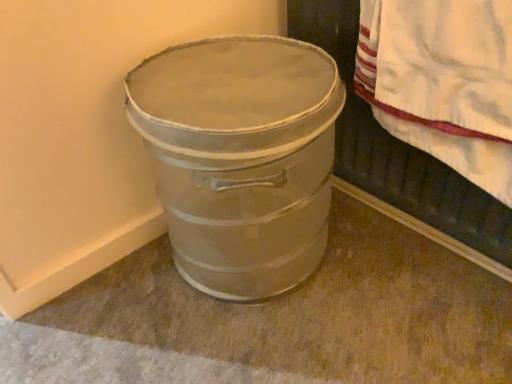
What do you see at coordinates (241, 158) in the screenshot? I see `metallic gray bucket at lower left` at bounding box center [241, 158].

You are a GUI agent. You are given a task and a screenshot of the screen. Output one action in this format:
    pyautogui.click(x=<x>, y=<y>)
    Task: Click on the metallic silver bucket at lower left
    
    Given the screenshot: What is the action you would take?
    pyautogui.click(x=280, y=319)

The image size is (512, 384). Find the location of `metallic gray bucket at lower left`. metallic gray bucket at lower left is located at coordinates (241, 158).

Is white textured towel at upper right positioned with its back to metallic silver bucket at lower left?

No, white textured towel at upper right is not facing the opposite direction of metallic silver bucket at lower left.

Is the surface of white textured towel at upper right in direct contact with metallic silver bucket at lower left?

white textured towel at upper right and metallic silver bucket at lower left are not in contact.

From the image's perspective, would you say white textured towel at upper right is positioned over metallic silver bucket at lower left?

Yes, from the image's perspective, white textured towel at upper right is over metallic silver bucket at lower left.

Do you think white textured towel at upper right is within metallic silver bucket at lower left, or outside of it?

white textured towel at upper right is not inside metallic silver bucket at lower left, it's outside.

Is metallic gray bucket at lower left completely or partially outside of white textured towel at upper right?

That's correct, metallic gray bucket at lower left is outside of white textured towel at upper right.

From the image's perspective, is metallic gray bucket at lower left under white textured towel at upper right?

Yes, from the image's perspective, metallic gray bucket at lower left is beneath white textured towel at upper right.

Which object is positioned more to the right, metallic gray bucket at lower left or white textured towel at upper right?

From the viewer's perspective, white textured towel at upper right appears more on the right side.

Is metallic gray bucket at lower left with white textured towel at upper right?

No, metallic gray bucket at lower left is not beside white textured towel at upper right.

Is metallic silver bucket at lower left inside or outside of white textured towel at upper right?

The correct answer is: outside.

Is metallic silver bucket at lower left not close to white textured towel at upper right?

metallic silver bucket at lower left is actually quite close to white textured towel at upper right.

Consider the image. Which of these two, metallic silver bucket at lower left or white textured towel at upper right, is thinner?

white textured towel at upper right.

Between metallic silver bucket at lower left and white textured towel at upper right, which one has more height?

white textured towel at upper right is taller.

You are a GUI agent. You are given a task and a screenshot of the screen. Output one action in this format:
    pyautogui.click(x=<x>, y=<y>)
    Task: Click on the waste container lying behind the metallic silver bucket at lower left
    The image size is (512, 384).
    Given the screenshot: What is the action you would take?
    (x=241, y=158)

How different are the orientations of metallic gray bucket at lower left and metallic silver bucket at lower left in degrees?

There is a 90.6-degree angle between the facing directions of metallic gray bucket at lower left and metallic silver bucket at lower left.

Is metallic gray bucket at lower left to the right of metallic silver bucket at lower left from the viewer's perspective?

In fact, metallic gray bucket at lower left is to the left of metallic silver bucket at lower left.

Is metallic gray bucket at lower left positioned with its back to metallic silver bucket at lower left?

No, metallic silver bucket at lower left is not at the back of metallic gray bucket at lower left.

From a real-world perspective, relative to metallic gray bucket at lower left, is metallic silver bucket at lower left vertically above or below?

In terms of real-world spatial position, metallic silver bucket at lower left is below metallic gray bucket at lower left.

Which object is positioned more to the left, metallic silver bucket at lower left or metallic gray bucket at lower left?

metallic gray bucket at lower left is more to the left.

Based on the photo, is metallic silver bucket at lower left looking in the opposite direction of metallic gray bucket at lower left?

Yes, metallic silver bucket at lower left is facing away from metallic gray bucket at lower left.

Considering the relative sizes of metallic silver bucket at lower left and metallic gray bucket at lower left in the image provided, is metallic silver bucket at lower left thinner than metallic gray bucket at lower left?

No.

Considering the relative sizes of white textured towel at upper right and metallic gray bucket at lower left in the image provided, is white textured towel at upper right taller than metallic gray bucket at lower left?

No, white textured towel at upper right is not taller than metallic gray bucket at lower left.

From the picture: From the image's perspective, is white textured towel at upper right located above or below metallic gray bucket at lower left?

Based on their image positions, white textured towel at upper right is located above metallic gray bucket at lower left.

Considering the positions of objects white textured towel at upper right and metallic gray bucket at lower left in the image provided, who is in front, white textured towel at upper right or metallic gray bucket at lower left?

Positioned in front is white textured towel at upper right.

This screenshot has width=512, height=384. There is a metallic silver bucket at lower left. What are the coordinates of `blanket above it (from a real-world perspective)` in the screenshot? It's located at (443, 82).

This screenshot has height=384, width=512. Find the location of `blanket located in front of the metallic gray bucket at lower left`. blanket located in front of the metallic gray bucket at lower left is located at coordinates click(443, 82).

Estimate the real-world distances between objects in this image. Which object is further from metallic gray bucket at lower left, white textured towel at upper right or metallic silver bucket at lower left?

Based on the image, metallic silver bucket at lower left appears to be further to metallic gray bucket at lower left.

Considering their positions, is metallic silver bucket at lower left positioned closer to white textured towel at upper right than metallic gray bucket at lower left?

metallic gray bucket at lower left is positioned closer to the anchor white textured towel at upper right.

Looking at the image, which one is located closer to metallic silver bucket at lower left, metallic gray bucket at lower left or white textured towel at upper right?

metallic gray bucket at lower left is closer to metallic silver bucket at lower left.

Considering their positions, is metallic gray bucket at lower left positioned closer to white textured towel at upper right than metallic silver bucket at lower left?

Among the two, metallic gray bucket at lower left is located nearer to white textured towel at upper right.

Based on their spatial positions, is metallic silver bucket at lower left or white textured towel at upper right closer to metallic gray bucket at lower left?

white textured towel at upper right is closer to metallic gray bucket at lower left.

Estimate the real-world distances between objects in this image. Which object is closer to metallic silver bucket at lower left, white textured towel at upper right or metallic gray bucket at lower left?

Based on the image, metallic gray bucket at lower left appears to be nearer to metallic silver bucket at lower left.

Find the location of a particular element. This screenshot has height=384, width=512. waste container that lies between white textured towel at upper right and metallic silver bucket at lower left from top to bottom is located at coordinates (241, 158).